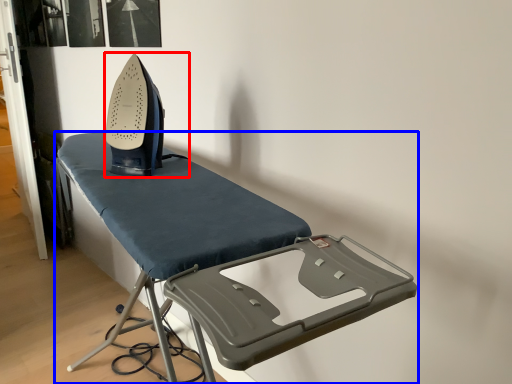
Question: Among these objects, which one is nearest to the camera, equipment (highlighted by a red box) or furniture (highlighted by a blue box)?

Choices:
 (A) equipment
 (B) furniture

Answer: (B)